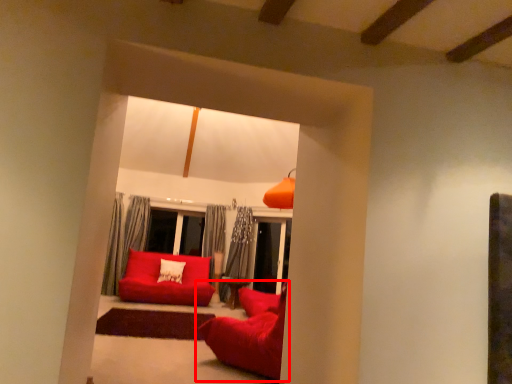
Question: Where is studio couch (annotated by the red box) located in relation to studio couch in the image?

Choices:
 (A) left
 (B) right

Answer: (B)